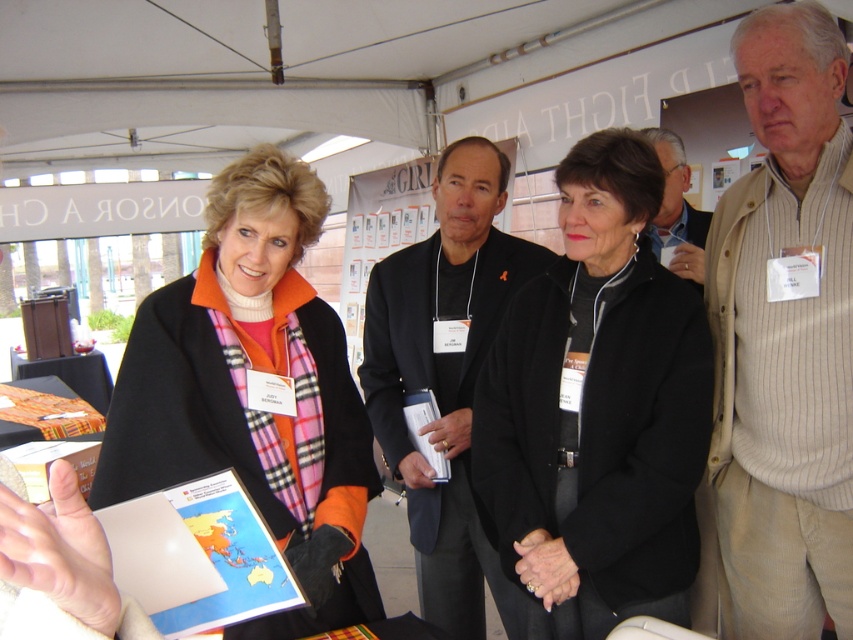
Question: Does beige striped shirt at center have a lesser width compared to gray striped sweater at upper right?

Choices:
 (A) no
 (B) yes

Answer: (A)

Question: Is beige striped shirt at center in front of black suit at center?

Choices:
 (A) yes
 (B) no

Answer: (A)

Question: Based on their relative distances, which object is farther from the gray striped sweater at upper right?

Choices:
 (A) black matte jacket at center
 (B) orange wool scarf at center
 (C) black suit at center
 (D) beige striped shirt at center

Answer: (B)

Question: Which point is closer to the camera?

Choices:
 (A) black suit at center
 (B) black matte jacket at center
 (C) beige striped shirt at center

Answer: (C)

Question: Among these objects, which one is farthest from the camera?

Choices:
 (A) gray striped sweater at upper right
 (B) black suit at center

Answer: (A)

Question: Can you confirm if black matte jacket at center is wider than orange wool scarf at center?

Choices:
 (A) yes
 (B) no

Answer: (B)